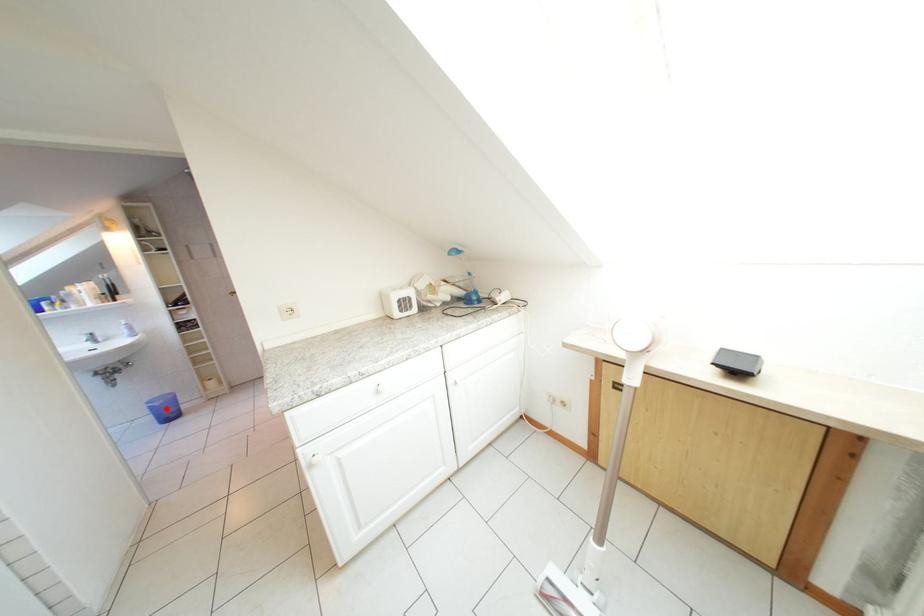
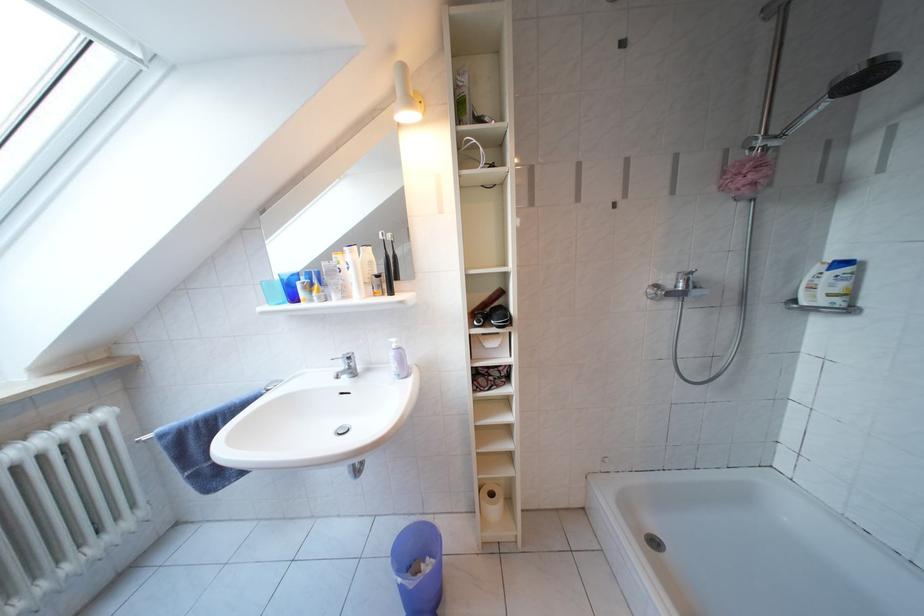
Where in the second image is the point corresponding to the highlighted location from the first image?

(419, 589)